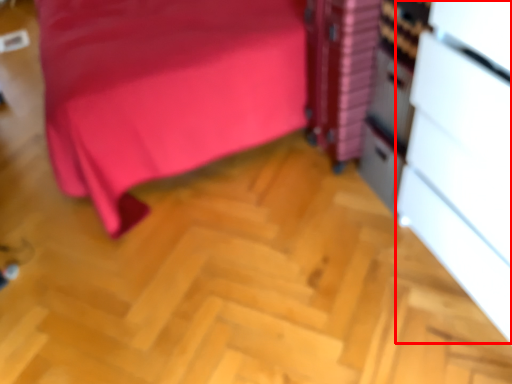
Question: From the image's perspective, considering the relative positions of file cabinet (annotated by the red box) and file cabinet in the image provided, where is file cabinet (annotated by the red box) located with respect to the staircase?

Choices:
 (A) below
 (B) above

Answer: (A)